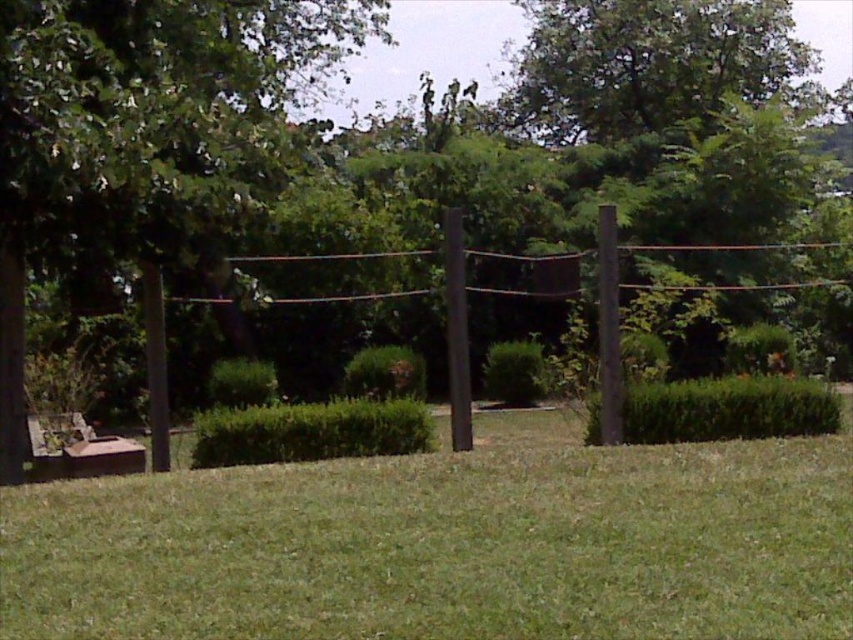
You are planning to place a small garden statue that is 1 meter wide on the green grass at center. Considering the smooth brown post at left is nearby, will the statue fit without overlapping the post?

The green grass at center has a larger width than the smooth brown post at left, so the statue can be placed on the grass without overlapping the post as there is enough space.

You are planning to place a new flower pot that requires a large area. Based on the scene, which object between green grass at center and wooden park bench at lower left would be more suitable for placing the flower pot?

The green grass at center has a larger size compared to the wooden park bench at lower left, so it would be more suitable for placing the flower pot that requires a large area.